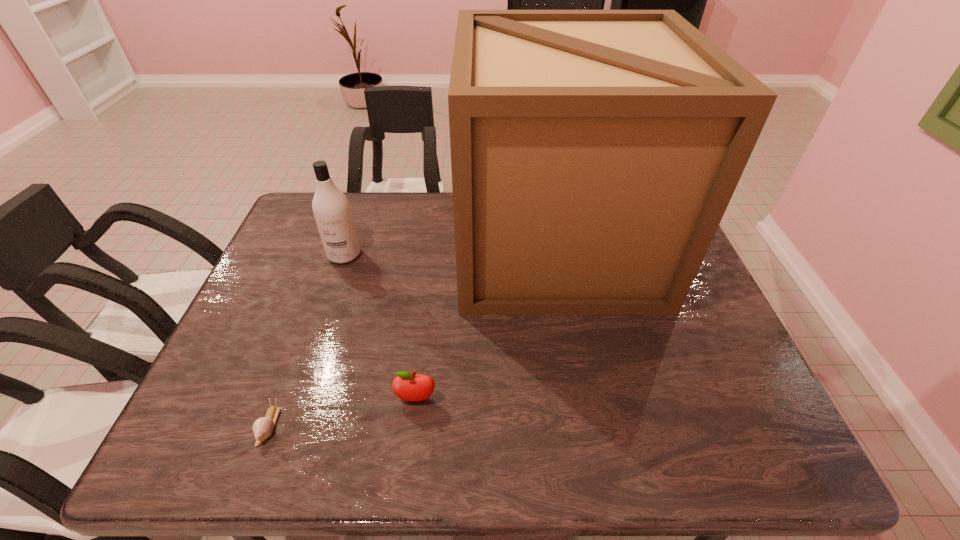
Locate an element on the screen. Image resolution: width=960 pixels, height=540 pixels. blank region between the tallest object and the shortest object is located at coordinates (412, 335).

The image size is (960, 540). I want to click on free space that is in between the escargot and the shampoo, so 306,340.

You are a GUI agent. You are given a task and a screenshot of the screen. Output one action in this format:
    pyautogui.click(x=<x>, y=<y>)
    Task: Click on the vacant space that's between the third tallest object and the box
    
    Given the screenshot: What is the action you would take?
    486,321

Where is `object identified as the third closest to the rightmost object`? This screenshot has height=540, width=960. object identified as the third closest to the rightmost object is located at coordinates (262, 427).

Locate which object ranks second in proximity to the rightmost object. Please provide its 2D coordinates. Your answer should be formatted as a tuple, i.e. [(x, y)], where the tuple contains the x and y coordinates of a point satisfying the conditions above.

[(331, 208)]

The height and width of the screenshot is (540, 960). Find the location of `vacant space that satisfies the following two spatial constraints: 1. on the reinforced sides of the tallest object; 2. on the front-facing side of the shampoo`. vacant space that satisfies the following two spatial constraints: 1. on the reinforced sides of the tallest object; 2. on the front-facing side of the shampoo is located at coordinates (557, 254).

You are a GUI agent. You are given a task and a screenshot of the screen. Output one action in this format:
    pyautogui.click(x=<x>, y=<y>)
    Task: Click on the free space that satisfies the following two spatial constraints: 1. on the reinforced sides of the rightmost object; 2. on the shell of the escargot
    The width and height of the screenshot is (960, 540).
    Given the screenshot: What is the action you would take?
    pyautogui.click(x=589, y=425)

I want to click on free region that satisfies the following two spatial constraints: 1. on the front-facing side of the shampoo; 2. on the left side of the apple, so click(x=296, y=399).

Locate an element on the screen. This screenshot has width=960, height=540. free region that satisfies the following two spatial constraints: 1. on the front-facing side of the second tallest object; 2. on the right side of the second shortest object is located at coordinates (296, 399).

Locate an element on the screen. This screenshot has height=540, width=960. vacant space that satisfies the following two spatial constraints: 1. on the front-facing side of the shampoo; 2. on the left side of the third tallest object is located at coordinates (296, 399).